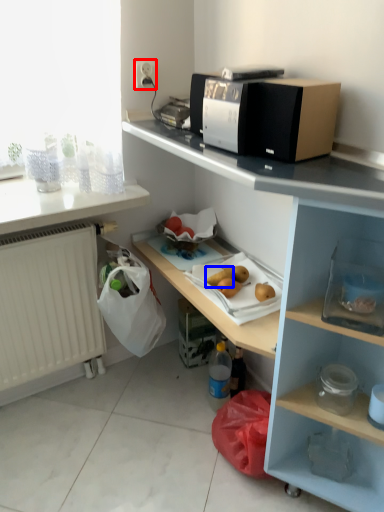
Question: Which object is closer to the camera taking this photo, electric outlet (highlighted by a red box) or fruit (highlighted by a blue box)?

Choices:
 (A) electric outlet
 (B) fruit

Answer: (B)